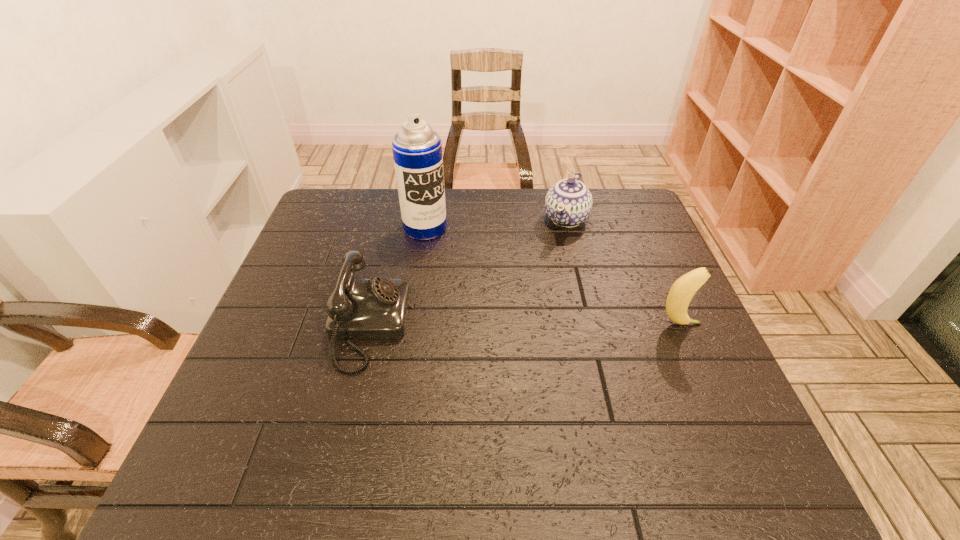
Image resolution: width=960 pixels, height=540 pixels. What are the coordinates of `vacant space in between the aerosol can and the chinaware` in the screenshot? It's located at (495, 224).

Locate an element on the screen. This screenshot has width=960, height=540. free space between the banana and the telephone is located at coordinates (524, 325).

Where is `object that stands as the second closest to the tallest object`? object that stands as the second closest to the tallest object is located at coordinates (568, 203).

Identify which object is the third nearest to the second object from right to left. Please provide its 2D coordinates. Your answer should be formatted as a tuple, i.e. [(x, y)], where the tuple contains the x and y coordinates of a point satisfying the conditions above.

[(377, 308)]

What are the coordinates of `vacant space that satisfies the following two spatial constraints: 1. on the back side of the aerosol can; 2. on the left side of the chinaware` in the screenshot? It's located at 426,219.

The image size is (960, 540). What are the coordinates of `free point that satisfies the following two spatial constraints: 1. on the front side of the aerosol can; 2. from the stem of the rightmost object` in the screenshot? It's located at (411, 324).